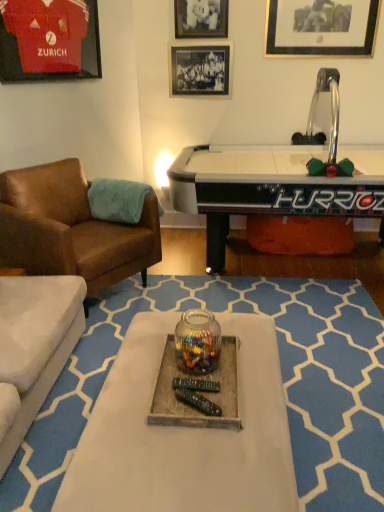
Find the location of a particular element. This screenshot has width=384, height=512. vacant area located to the right-hand side of black plastic remote control at center, arranged as the second remote control when viewed from the back is located at coordinates (226, 404).